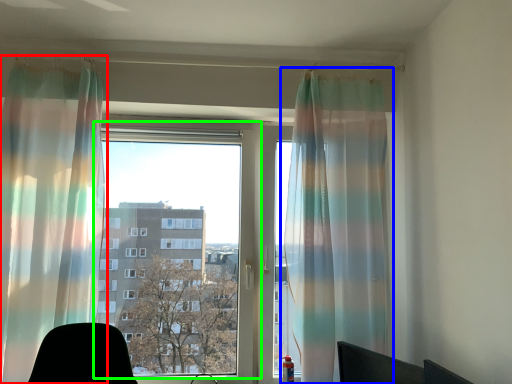
Question: Estimate the real-world distances between objects in this image. Which object is closer to curtain (highlighted by a red box), curtain (highlighted by a blue box) or window (highlighted by a green box)?

Choices:
 (A) curtain
 (B) window

Answer: (B)